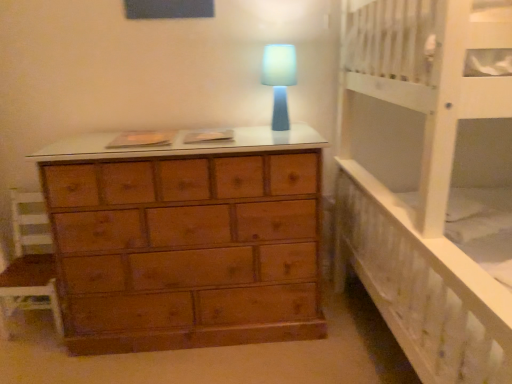
Question: Considering the positions of point (30, 288) and point (423, 238), is point (30, 288) closer or farther from the camera than point (423, 238)?

Choices:
 (A) farther
 (B) closer

Answer: (A)

Question: From the image's perspective, is wooden chair at left above or below white wooden bed at right?

Choices:
 (A) above
 (B) below

Answer: (B)

Question: Which object is positioned farthest from the blue matte lamp at center?

Choices:
 (A) wooden chair at left
 (B) white wooden bed at right

Answer: (A)

Question: Which object is positioned farthest from the white wooden bed at right?

Choices:
 (A) wooden chair at left
 (B) blue matte lamp at center

Answer: (A)